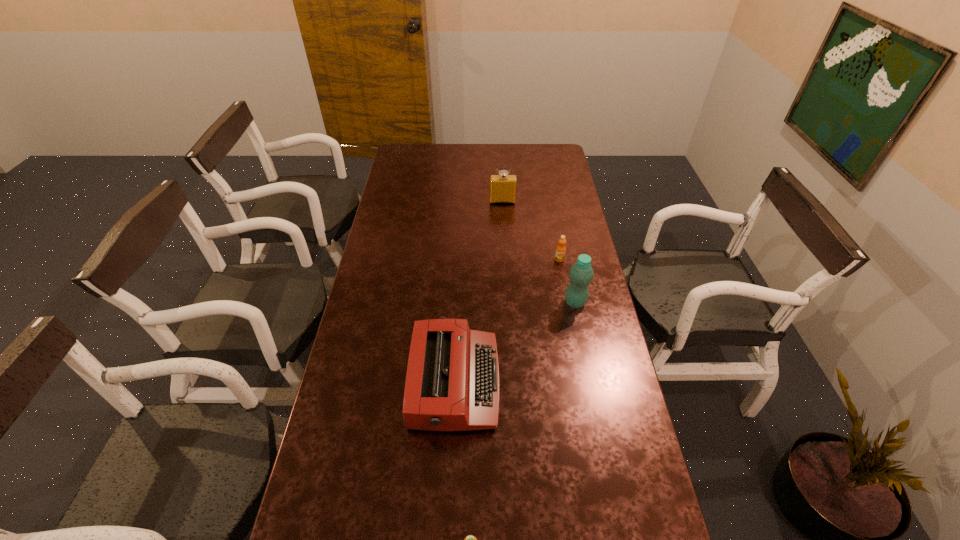
The width and height of the screenshot is (960, 540). What are the coordinates of `vacant area that satisfies the following two spatial constraints: 1. on the front-facing side of the farthest object; 2. on the typing side of the second nearest object` in the screenshot? It's located at (514, 382).

The image size is (960, 540). Identify the location of free location that satisfies the following two spatial constraints: 1. on the front-facing side of the perfume; 2. on the typing side of the typewriter. (514, 382).